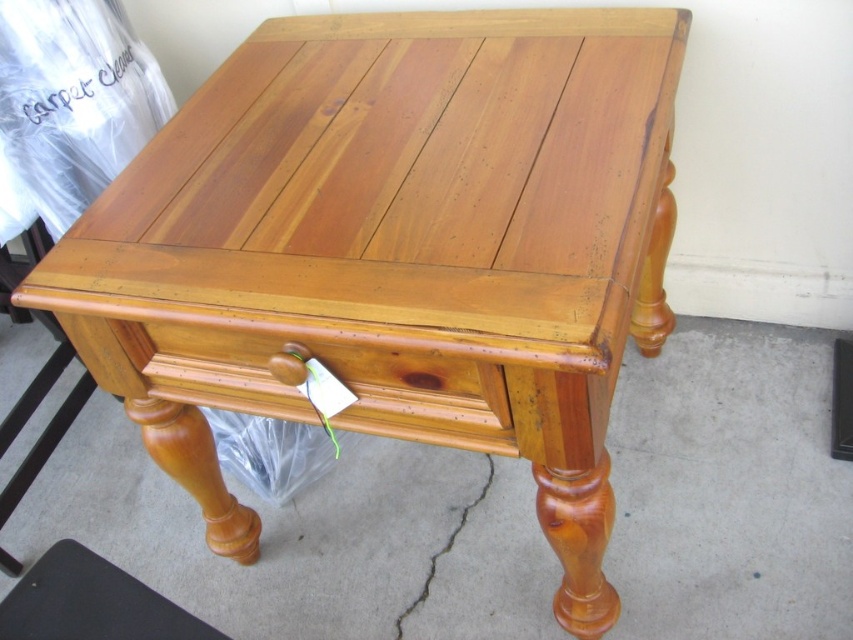
Is satin wood drawer at lower center closer to the viewer compared to satin wood stool at lower left?

Yes.

Which is above, satin wood drawer at lower center or satin wood stool at lower left?

satin wood drawer at lower center is above.

Does point (433, 428) come in front of point (51, 625)?

No.

You are a GUI agent. You are given a task and a screenshot of the screen. Output one action in this format:
    pyautogui.click(x=<x>, y=<y>)
    Task: Click on the satin wood drawer at lower center
    
    Given the screenshot: What is the action you would take?
    pyautogui.click(x=334, y=372)